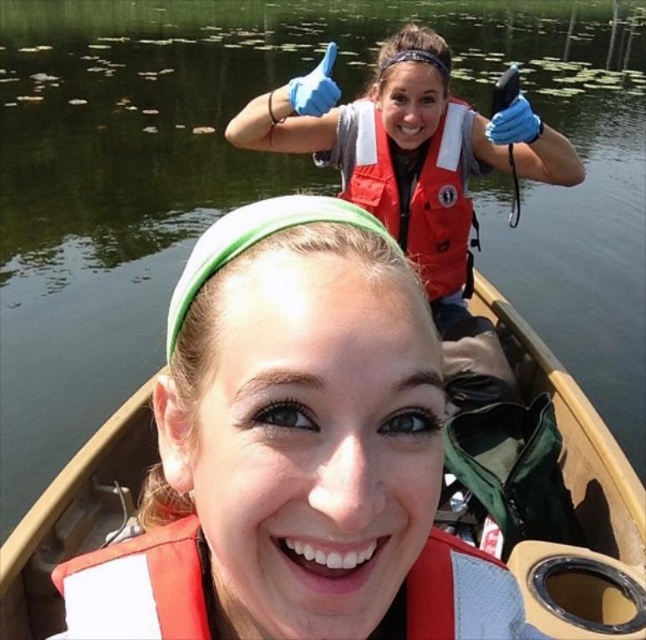
You are planning to place a 6 feet long pole between the matte red life jacket at lower center and the red matte life jacket at upper center. Based on the scene description, will the pole fit between them without exceeding the space?

The distance between the matte red life jacket at lower center and the red matte life jacket at upper center is 7.73 feet. Since the pole is 6 feet long, it will fit within the space between them as it is shorter than the available distance.

You are planning to take a photo of the brown wood boat at center and the matte red life jacket at lower center. Which object should be placed higher in the frame to ensure both are fully visible?

The brown wood boat at center is taller than the matte red life jacket at lower center, so to ensure both are fully visible, the brown wood boat at center should be placed higher in the frame.

You are navigating a canoe and need to determine the best spot to place a small cooler. The cooler must be positioned between the two points labeled point (333,605) and point (123,564). Based on their positions, which point should the cooler be closer to?

The cooler should be placed closer to point (123,564) because point (333,605) is in front of it, meaning the cooler needs to be positioned behind point (333,605) to stay between both points.